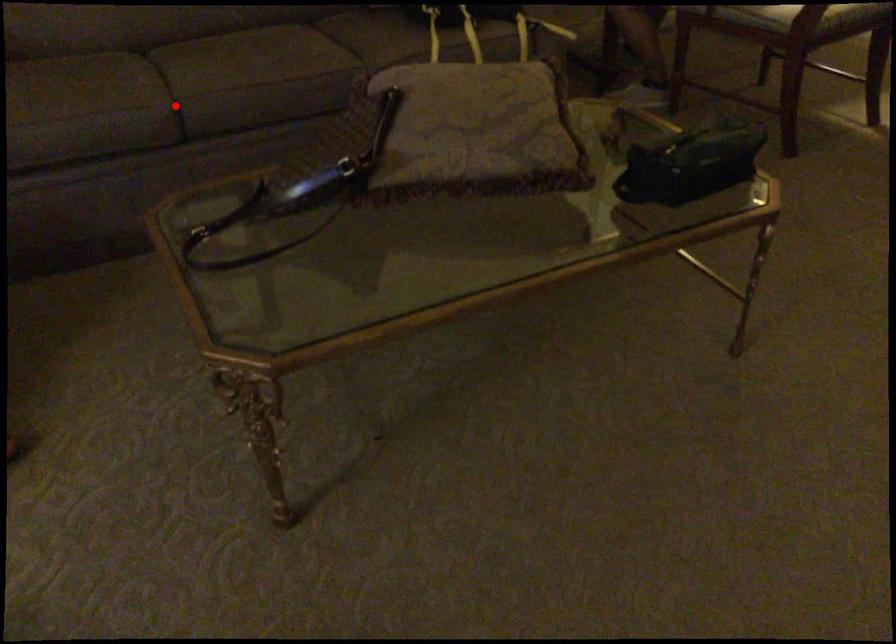
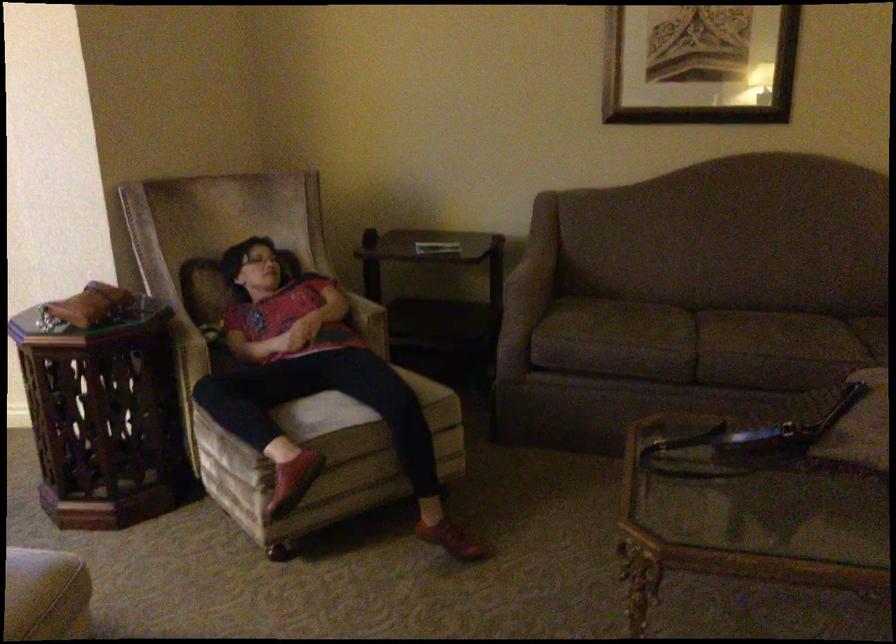
Locate, in the second image, the point that corresponds to the highlighted location in the first image.

(695, 345)